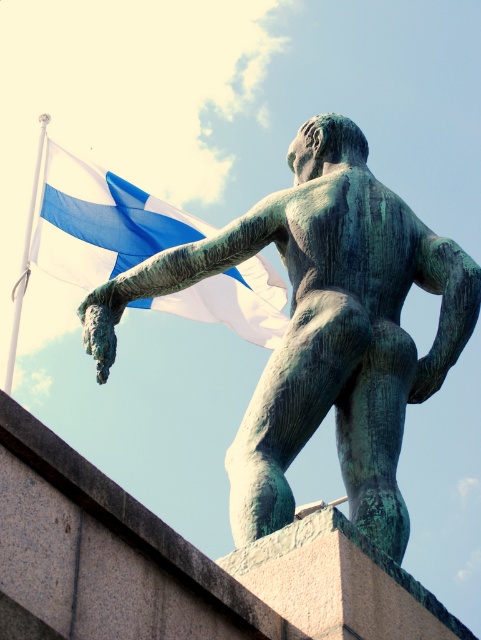
Is point (387, 316) less distant than point (153, 234)?

Yes, it is.

Does green patina statue at center come in front of blue fabric flag at upper left?

Yes.

Image resolution: width=481 pixels, height=640 pixels. Describe the element at coordinates (323, 328) in the screenshot. I see `green patina statue at center` at that location.

In order to click on green patina statue at center in this screenshot , I will do `click(323, 328)`.